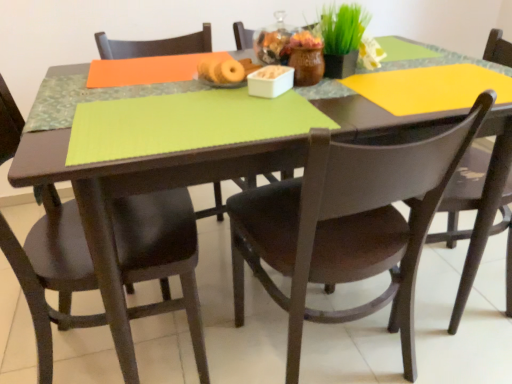
Question: From a real-world perspective, is green matte plant at upper center over matte black chair at right, positioned as the 3th chair in left-to-right order?

Choices:
 (A) no
 (B) yes

Answer: (B)

Question: Is green matte plant at upper center wider than matte black chair at right, positioned as the 3th chair in left-to-right order?

Choices:
 (A) yes
 (B) no

Answer: (B)

Question: Does green matte plant at upper center have a lesser height compared to matte black chair at right, the first chair from the right?

Choices:
 (A) yes
 (B) no

Answer: (A)

Question: Can you confirm if green matte plant at upper center is bigger than matte black chair at right, the first chair from the right?

Choices:
 (A) no
 (B) yes

Answer: (A)

Question: Does green matte plant at upper center have a greater height compared to matte black chair at right, the first chair from the right?

Choices:
 (A) no
 (B) yes

Answer: (A)

Question: Considering the positions of matte black chair at left, which is the 3th chair in right-to-left order, and green matte plant at upper center in the image, is matte black chair at left, which is the 3th chair in right-to-left order, bigger or smaller than green matte plant at upper center?

Choices:
 (A) big
 (B) small

Answer: (A)

Question: Visually, is matte black chair at left, the 1th chair in the left-to-right sequence, positioned to the left or to the right of green matte plant at upper center?

Choices:
 (A) left
 (B) right

Answer: (A)

Question: From a real-world perspective, relative to green matte plant at upper center, is matte black chair at left, the 1th chair in the left-to-right sequence, vertically above or below?

Choices:
 (A) above
 (B) below

Answer: (B)

Question: Is matte black chair at left, the 1th chair in the left-to-right sequence, situated inside green matte plant at upper center or outside?

Choices:
 (A) outside
 (B) inside

Answer: (A)

Question: From the image's perspective, is green matte plant at upper center above or below matte black chair at left, which is the 3th chair in right-to-left order?

Choices:
 (A) above
 (B) below

Answer: (A)

Question: Is green matte plant at upper center taller or shorter than matte black chair at left, which is the 3th chair in right-to-left order?

Choices:
 (A) tall
 (B) short

Answer: (B)

Question: In terms of width, does green matte plant at upper center look wider or thinner when compared to matte black chair at left, which is the 3th chair in right-to-left order?

Choices:
 (A) wide
 (B) thin

Answer: (B)

Question: Which is correct: green matte plant at upper center is inside matte black chair at left, which is the 3th chair in right-to-left order, or outside of it?

Choices:
 (A) inside
 (B) outside

Answer: (B)

Question: Is matte black chair at center, which is the 2th chair from left to right, to the left or to the right of green matte plant at upper center in the image?

Choices:
 (A) right
 (B) left

Answer: (A)

Question: Considering the positions of matte black chair at center, which is the 2th chair from left to right, and green matte plant at upper center in the image, is matte black chair at center, which is the 2th chair from left to right, bigger or smaller than green matte plant at upper center?

Choices:
 (A) small
 (B) big

Answer: (B)